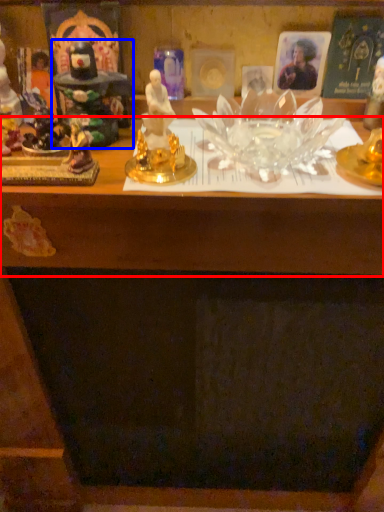
Question: Which of the following is the farthest to the observer, table (highlighted by a red box) or toy (highlighted by a blue box)?

Choices:
 (A) table
 (B) toy

Answer: (B)